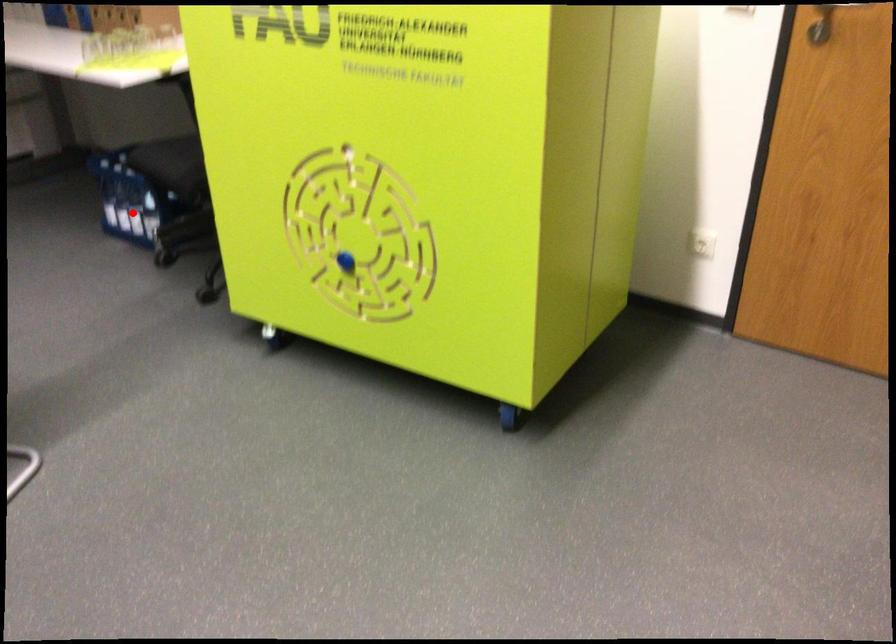
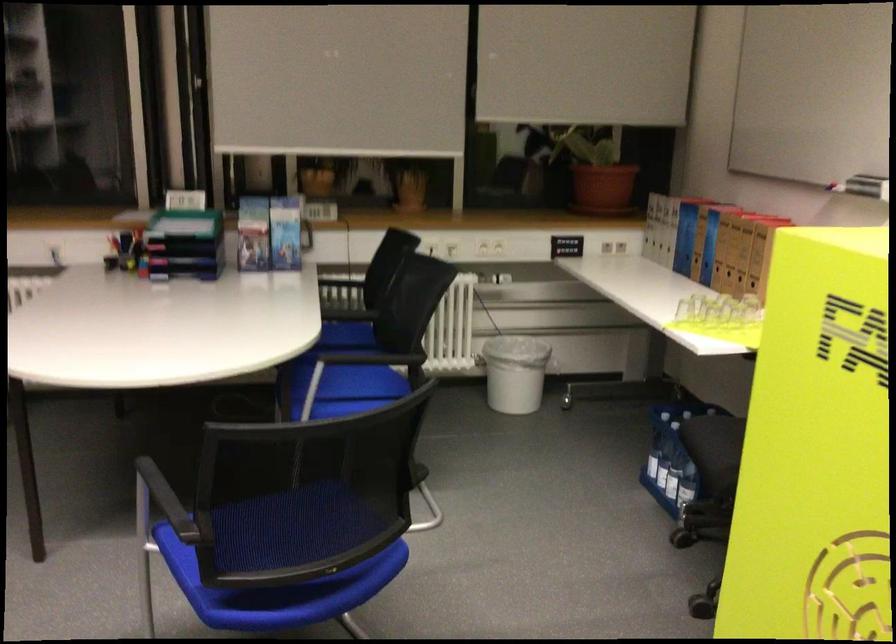
Question: I am providing you with two images of the same scene from different viewpoints. A red point is shown in image1. For the corresponding object point in image2, is it positioned nearer or farther from the camera?

Choices:
 (A) Nearer
 (B) Farther

Answer: (A)